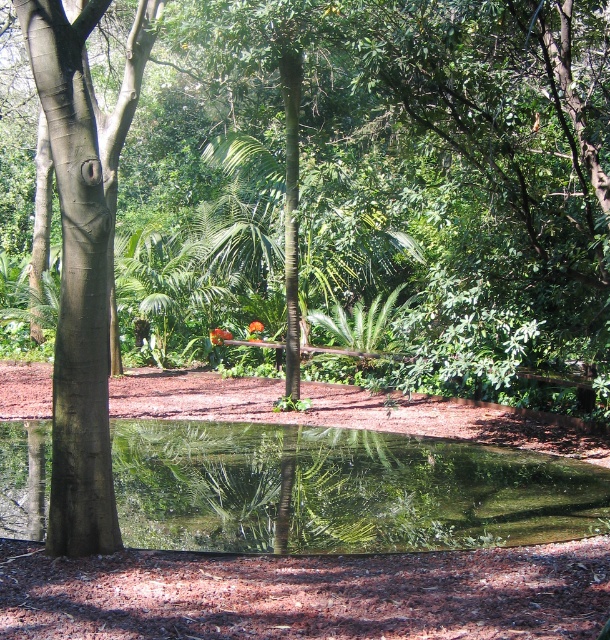
You are an artist planning to paint this garden scene. You want to ensure the transparent glass puddle at center and the smooth brown tree trunk at left are accurately sized relative to each other. Based on the scene, which object should you depict as smaller in your painting?

The transparent glass puddle at center should be depicted as smaller than the smooth brown tree trunk at left because it occupies less space according to the description.

You are standing in the garden and see two points marked on the ground. One is at point coordinates (547, 508) and the other at (98, 150). Which point is closer to you?

Point (98, 150) is closer to you because point (547, 508) is behind it.

You are a gardener checking the garden layout. You want to place a new decorative stone between the smooth brown tree trunk at left and the transparent glass puddle at center. Since you can see the tree trunk through the puddle, where exactly should you place the stone so it won

The smooth brown tree trunk at left is behind the transparent glass puddle at center, so placing the stone in front of the transparent glass puddle at center would ensure it is between both objects.